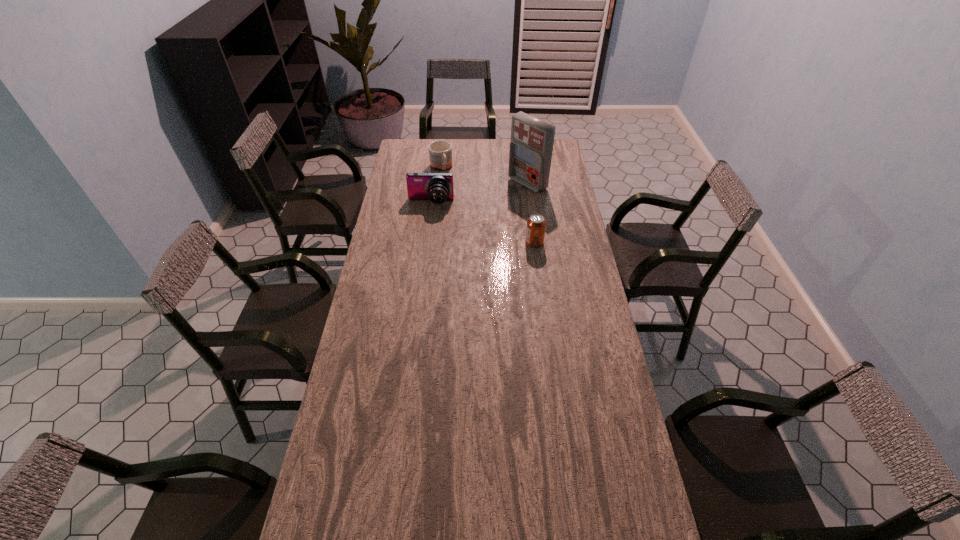
Image resolution: width=960 pixels, height=540 pixels. In order to click on free location located 0.320m on the front-facing side of the tallest object in this screenshot , I will do `click(468, 219)`.

Find the location of a particular element. The image size is (960, 540). blank area located 0.170m on the front-facing side of the tallest object is located at coordinates (491, 206).

This screenshot has height=540, width=960. In order to click on object located at the far edge in this screenshot , I will do `click(440, 152)`.

Identify the location of object that is at the left edge. The width and height of the screenshot is (960, 540). (437, 187).

You are a GUI agent. You are given a task and a screenshot of the screen. Output one action in this format:
    pyautogui.click(x=<x>, y=<y>)
    Task: Click on the object at the right edge
    Image resolution: width=960 pixels, height=540 pixels.
    Given the screenshot: What is the action you would take?
    pyautogui.click(x=530, y=154)

Where is `vacant space at the far edge of the desktop`? The height and width of the screenshot is (540, 960). vacant space at the far edge of the desktop is located at coordinates (497, 157).

Locate an element on the screen. free space at the near edge of the desktop is located at coordinates (419, 510).

Identify the location of vacant space at the left edge of the desktop. Image resolution: width=960 pixels, height=540 pixels. (406, 272).

The height and width of the screenshot is (540, 960). In the image, there is a desktop. What are the coordinates of `vacant space at the right edge` in the screenshot? It's located at (559, 226).

Identify the location of blank region between the tallest object and the mug. (484, 176).